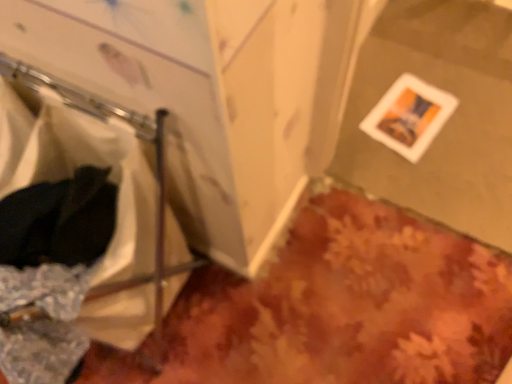
Question: Is white matte picture frame at lower right in front of or behind white fabric laundry at left in the image?

Choices:
 (A) behind
 (B) front

Answer: (A)

Question: Considering the positions of white matte picture frame at lower right and white fabric laundry at left in the image, is white matte picture frame at lower right wider or thinner than white fabric laundry at left?

Choices:
 (A) thin
 (B) wide

Answer: (A)

Question: From their relative heights in the image, would you say white matte picture frame at lower right is taller or shorter than white fabric laundry at left?

Choices:
 (A) tall
 (B) short

Answer: (B)

Question: Is white fabric laundry at left in front of or behind white matte picture frame at lower right in the image?

Choices:
 (A) front
 (B) behind

Answer: (A)

Question: From the image's perspective, is white fabric laundry at left above or below white matte picture frame at lower right?

Choices:
 (A) below
 (B) above

Answer: (A)

Question: Considering the positions of white fabric laundry at left and white matte picture frame at lower right in the image, is white fabric laundry at left wider or thinner than white matte picture frame at lower right?

Choices:
 (A) thin
 (B) wide

Answer: (B)

Question: From a real-world perspective, is white fabric laundry at left positioned above or below white matte picture frame at lower right?

Choices:
 (A) above
 (B) below

Answer: (A)